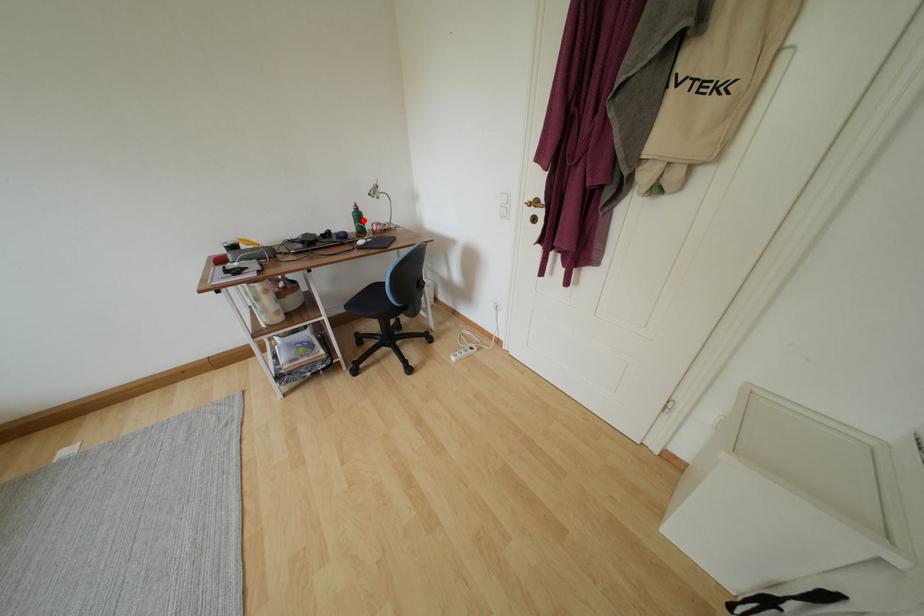
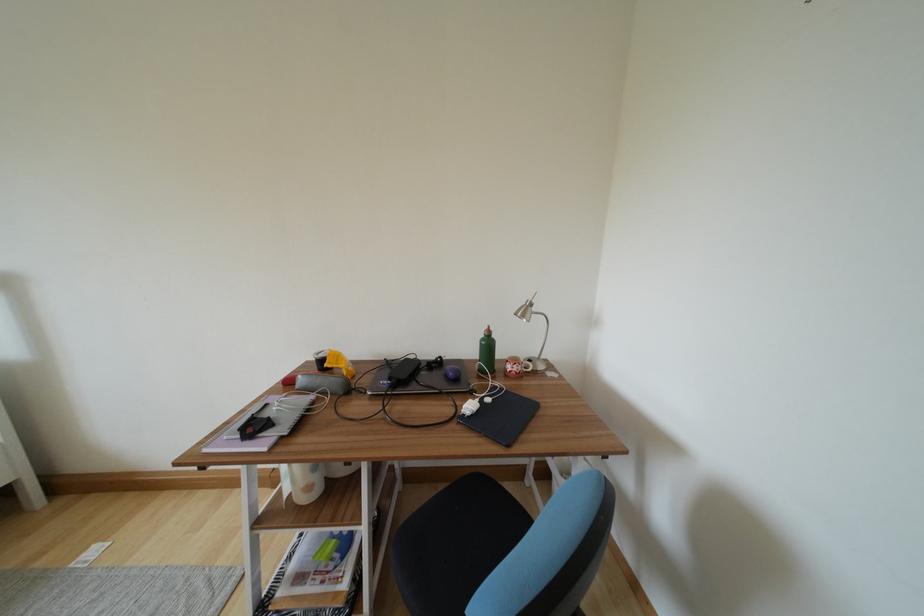
Question: I am providing you with two images of the same scene from different viewpoints. In image1, a red point is highlighted. Considering the same 3D point in image2, which of the following is correct?

Choices:
 (A) It is closer
 (B) It is farther

Answer: (B)